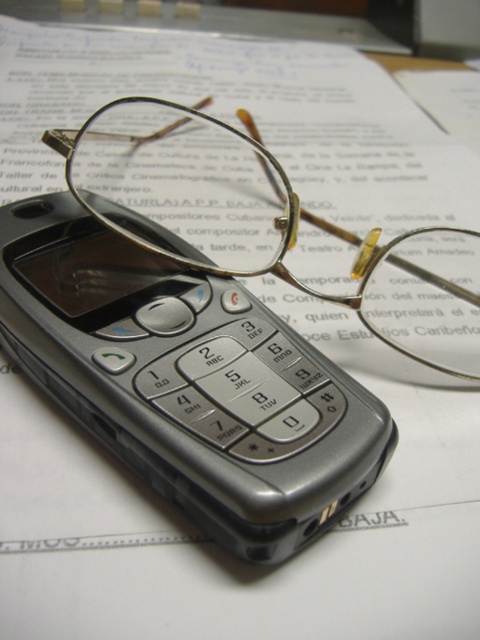
You are trying to place the silver metallic phone at center into a storage box that can only accommodate items narrower than the gold metallic glasses at center. Can the phone fit inside the box?

The silver metallic phone at center is narrower than the gold metallic glasses at center, so it can fit inside the box.

You are organizing a desk and need to place a small sticker between the silver metallic phone at center and the gold metallic glasses at center. Which side of the phone should you place the sticker so it is between them?

The silver metallic phone at center is to the left of the gold metallic glasses at center, so placing the sticker to the right side of the silver metallic phone at center will position it between them.

You are standing in front of a desk with a silver metallic phone at center. If you want to place a small sticker exactly at the center of the phone, what are the coordinates you should aim for?

The coordinates for the center of the silver metallic phone at center are at point [187,380].